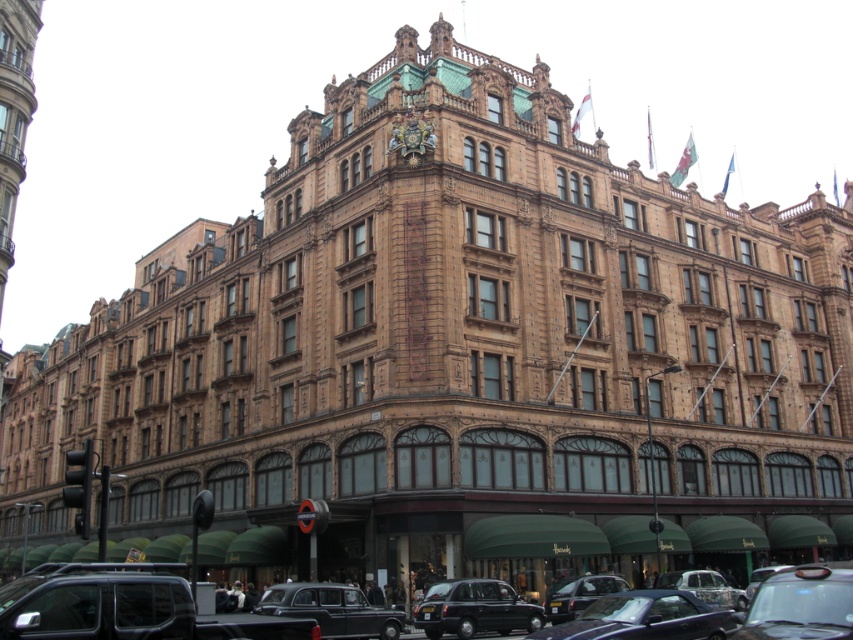
Question: Is shiny black car at lower right above silver metallic car at center?

Choices:
 (A) no
 (B) yes

Answer: (B)

Question: Among these objects, which one is farthest from the camera?

Choices:
 (A) black polished taxi at lower center
 (B) black metallic car at lower center
 (C) black metallic taxi at lower center

Answer: (B)

Question: Which object is farther from the camera taking this photo?

Choices:
 (A) black polished taxi at lower center
 (B) black metallic taxi at lower center
 (C) shiny black car at lower center

Answer: (B)

Question: Does black polished taxi at lower center come in front of black metallic car at lower center?

Choices:
 (A) yes
 (B) no

Answer: (A)

Question: Which point is closer to the camera?

Choices:
 (A) black glass traffic light at lower left
 (B) black metallic taxi at lower center
 (C) black polished taxi at lower center
 (D) silver metallic car at center

Answer: (A)

Question: Is black polished taxi at lower center smaller than black metallic car at lower center?

Choices:
 (A) yes
 (B) no

Answer: (B)